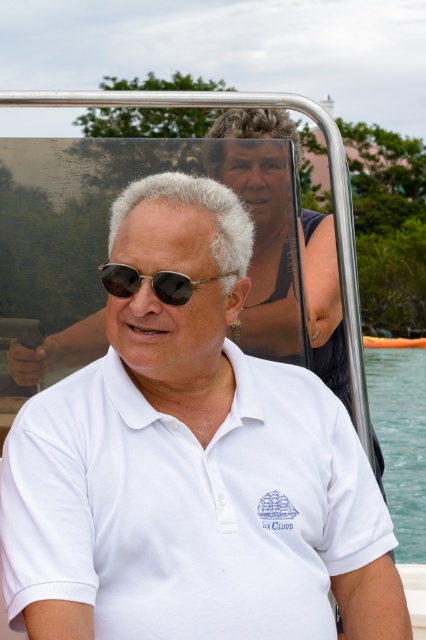
You are a photographer taking a picture of the scene described. You notice the white cotton polo shirt at center and the shiny black sunglasses at center. Which object is closer to the camera lens?

The white cotton polo shirt at center is positioned under the shiny black sunglasses at center, so the sunglasses are closer to the camera lens.

You are a photographer on a boat and need to capture a clear shot of the white cotton polo shirt at center and the shiny black sunglasses at center. Since the boat is moving, you want to ensure both items are in frame. Based on their positions, which item should you focus on first to keep both in the shot?

The white cotton polo shirt at center is positioned on the right side of shiny black sunglasses at center. To keep both in frame, focus on the shiny black sunglasses at center first as it is on the left, allowing the polo shirt to remain in the shot as the boat moves.

You are on a boat and need to reach a specific location marked by point (x=420, y=410) and point (x=123, y=285). Which point is closer to you?

Point (x=420, y=410) is closer to you because it is further to the viewer than point (x=123, y=285).